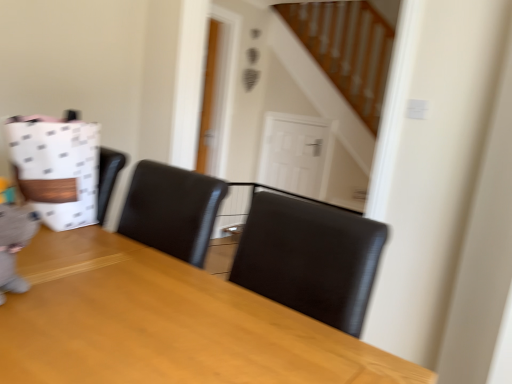
You are a GUI agent. You are given a task and a screenshot of the screen. Output one action in this format:
    pyautogui.click(x=<x>, y=<y>)
    Task: Click on the vacant region above wooden table at center (from a real-world perspective)
    This screenshot has width=512, height=384.
    Given the screenshot: What is the action you would take?
    pyautogui.click(x=126, y=294)